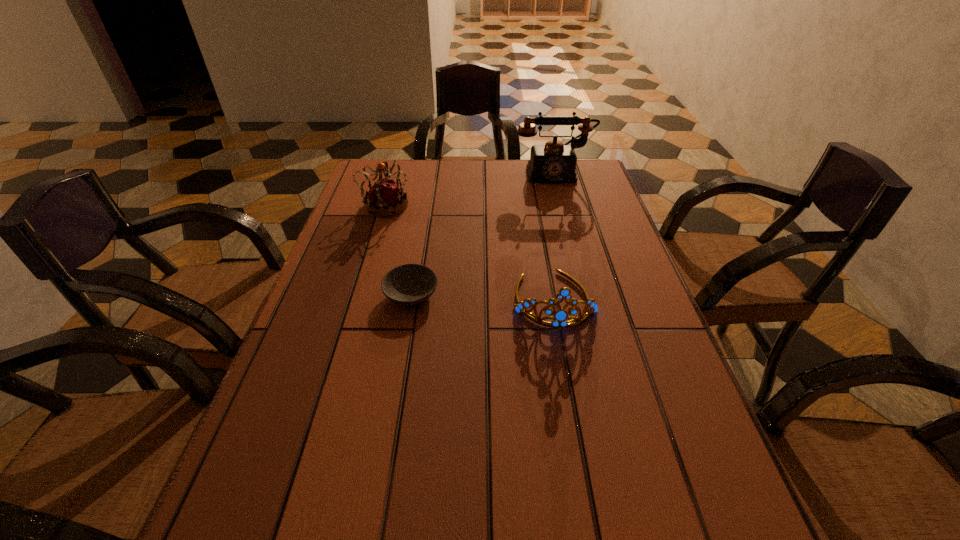
Locate an element on the screen. The width and height of the screenshot is (960, 540). the tallest object is located at coordinates (555, 162).

You are a GUI agent. You are given a task and a screenshot of the screen. Output one action in this format:
    pyautogui.click(x=<x>, y=<y>)
    Task: Click on the telephone
    This screenshot has width=960, height=540.
    Given the screenshot: What is the action you would take?
    pyautogui.click(x=555, y=162)

Where is `the left tiara`? The height and width of the screenshot is (540, 960). the left tiara is located at coordinates (384, 197).

The height and width of the screenshot is (540, 960). I want to click on the farther tiara, so click(x=384, y=197).

At what (x,y) coordinates should I click in order to perform the action: click on the second shortest object. Please return your answer as a coordinate pair (x, y). The height and width of the screenshot is (540, 960). Looking at the image, I should click on (559, 318).

Identify the location of the right tiara. This screenshot has height=540, width=960. (559, 318).

Where is `the shortest object`? This screenshot has height=540, width=960. the shortest object is located at coordinates (410, 284).

Locate an element on the screen. The image size is (960, 540). free space located 0.380m on the front of the tallest object at the rotary dial is located at coordinates (576, 260).

Locate an element on the screen. free space located on the front-facing side of the left tiara is located at coordinates (454, 206).

Find the location of a particular element. The image size is (960, 540). vacant space located on the front-facing side of the nearer tiara is located at coordinates (583, 457).